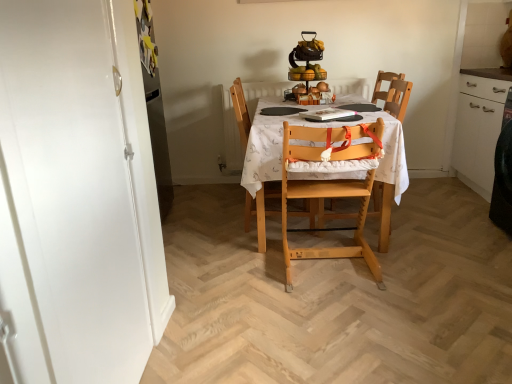
Question: In terms of height, does wooden chair with cushion at center, the 1th chair in the left-to-right sequence, look taller or shorter compared to light wood highchair at center, acting as the 2th chair starting from the right?

Choices:
 (A) tall
 (B) short

Answer: (A)

Question: Does point (246, 119) appear closer or farther from the camera than point (315, 155)?

Choices:
 (A) farther
 (B) closer

Answer: (A)

Question: Which object is the closest to the white printed fabric at center?

Choices:
 (A) light wood highchair at center, which is counted as the second chair, starting from the left
 (B) wooden chair with cushion at center, acting as the third chair starting from the right
 (C) wooden highchair at center, arranged as the third chair when viewed from the left

Answer: (A)

Question: Which object is the farthest from the light wood highchair at center, which is counted as the second chair, starting from the left?

Choices:
 (A) wooden highchair at center, marked as the first chair in a right-to-left arrangement
 (B) wooden chair with cushion at center, the 1th chair in the left-to-right sequence
 (C) white printed fabric at center

Answer: (A)